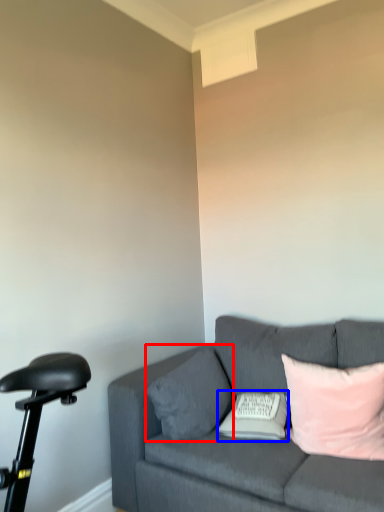
Question: Which point is further to the camera, pillow (highlighted by a red box) or pillow (highlighted by a blue box)?

Choices:
 (A) pillow
 (B) pillow

Answer: (A)